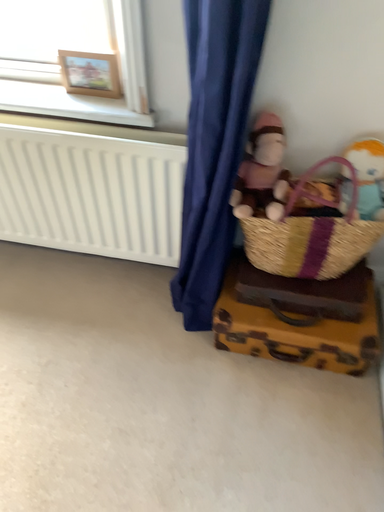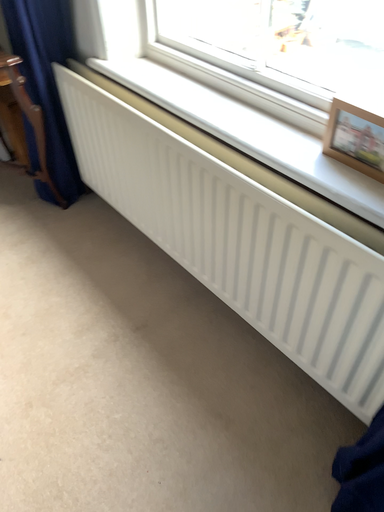
Question: Which way did the camera rotate in the video?

Choices:
 (A) rotated right
 (B) rotated left

Answer: (B)